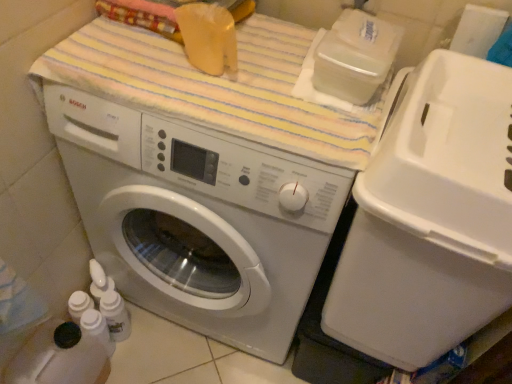
I want to click on blank space situated above striped cotton bath towel at upper center (from a real-world perspective), so click(x=212, y=73).